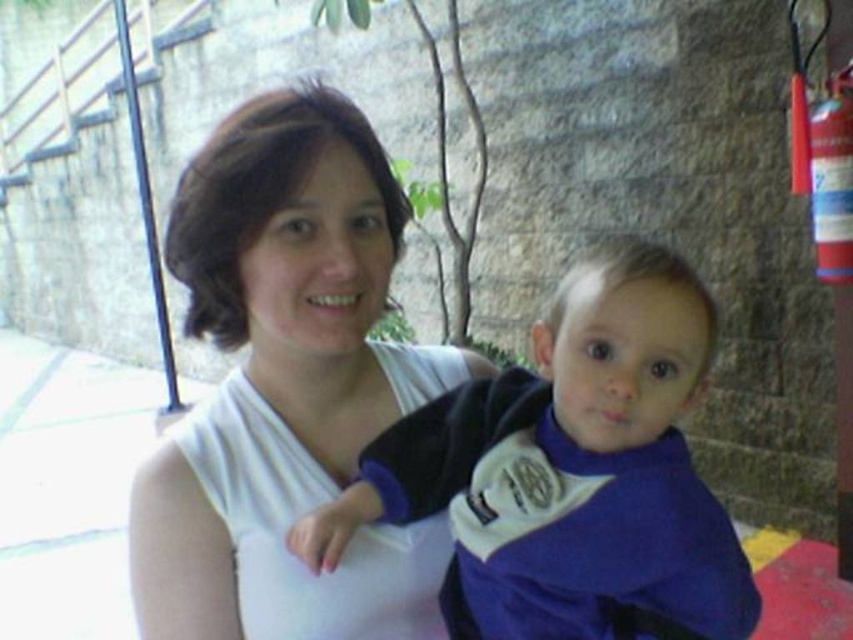
Question: Which of the following is the closest to the observer?

Choices:
 (A) white matte shirt at center
 (B) purple fleece jacket at center

Answer: (B)

Question: Does white matte shirt at center have a smaller size compared to purple fleece jacket at center?

Choices:
 (A) yes
 (B) no

Answer: (B)

Question: Which object is closer to the camera taking this photo?

Choices:
 (A) purple fleece jacket at center
 (B) white matte shirt at center

Answer: (A)

Question: Is white matte shirt at center to the right of purple fleece jacket at center from the viewer's perspective?

Choices:
 (A) no
 (B) yes

Answer: (A)

Question: Does white matte shirt at center come behind purple fleece jacket at center?

Choices:
 (A) no
 (B) yes

Answer: (B)